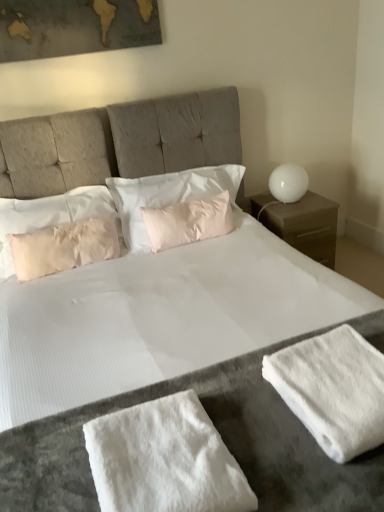
Find the location of a particular element. The height and width of the screenshot is (512, 384). vacant area that lies between white fluffy bath towel at lower right and white fluffy towel at lower center is located at coordinates (271, 441).